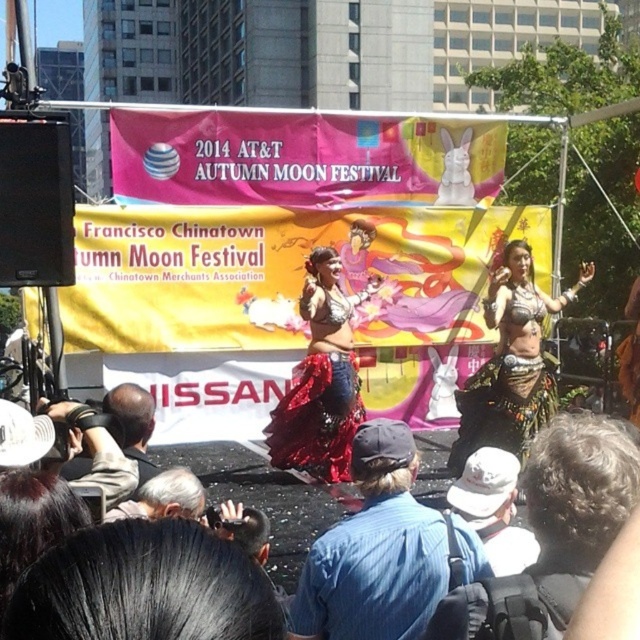
You are a photographer at the 2014 AT T Autumn Moon Festival in San Francisco Chinatown. You have a white cotton hat at center and a dark gray fabric camera at lower left in your view. Which object is narrower in width?

The white cotton hat at center has a lesser width compared to dark gray fabric camera at lower left.

You are attending the 2014 ATATT Moon Festival in San Francisco Chinatown and notice two items at the center of the scene. Which one takes up more space, the blue denim shirt at center or the shiny red fabric at center?

The shiny red fabric at center takes up more space than the blue denim shirt at center because the blue denim shirt at center occupies less space than shiny red fabric at center.

From the picture: You are attending the 2014 ATATT Moon Festival in San Francisco Chinatown and want to take a photo of the blue denim shirt at center. If your camera has a maximum focus range of 3 meters, will you be able to capture a clear photo without moving closer?

The blue denim shirt at center is 3.35 meters away from the viewer. Since the camera can only focus up to 3 meters, you won